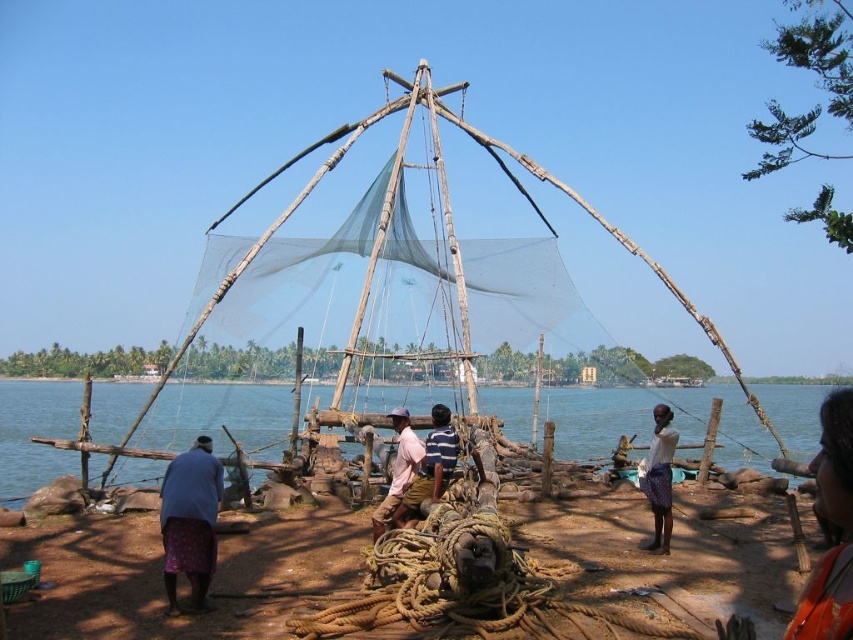
Consider the image. Who is shorter, dark purple fabric at center or striped fabric shirt at center?

Standing shorter between the two is striped fabric shirt at center.

Can you confirm if dark purple fabric at center is positioned above striped fabric shirt at center?

No.

Is point (666, 493) closer to viewer compared to point (430, 497)?

No, it is not.

Locate an element on the screen. Image resolution: width=853 pixels, height=640 pixels. dark purple fabric at center is located at coordinates (660, 477).

Does blue fabric skirt at lower left have a greater height compared to dark purple fabric at center?

In fact, blue fabric skirt at lower left may be shorter than dark purple fabric at center.

Which of these two, blue fabric skirt at lower left or dark purple fabric at center, stands shorter?

Standing shorter between the two is blue fabric skirt at lower left.

Does point (190, 509) come in front of point (666, 440)?

Yes, point (190, 509) is closer to viewer.

Image resolution: width=853 pixels, height=640 pixels. I want to click on blue fabric skirt at lower left, so click(x=190, y=520).

Between point (413, 452) and point (439, 416), which one is positioned behind?

The point (413, 452) is more distant.

Looking at this image, can you confirm if light pink fabric at center is thinner than striped fabric shirt at center?

In fact, light pink fabric at center might be wider than striped fabric shirt at center.

Is point (399, 416) farther from viewer compared to point (434, 496)?

That is True.

Where is `light pink fabric at center`? The height and width of the screenshot is (640, 853). light pink fabric at center is located at coordinates (399, 468).